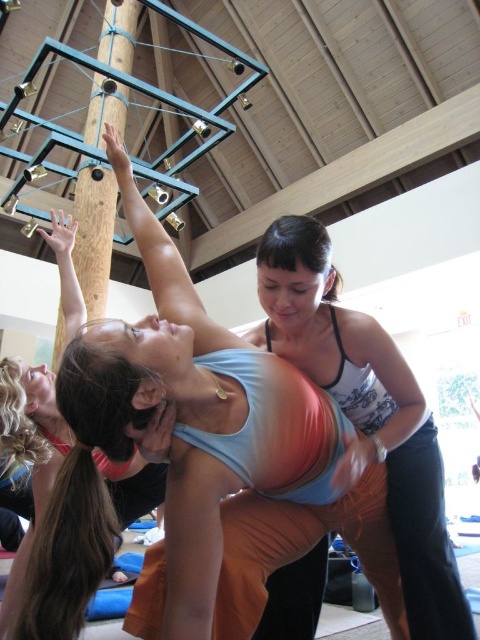
You are a photographer setting up for a yoga class photo. You need to ensure that the matte blue tank top at center and the matte black tank top at center are visible in the frame. Based on their heights, which one might you need to position closer to the camera to ensure both are fully visible?

The matte blue tank top at center is taller than the matte black tank top at center. To ensure both are fully visible, position the shorter matte black tank top at center closer to the camera so it appears larger in the frame, while the taller matte blue tank top at center can be slightly further back.

You are a photographer setting up for a photoshoot in this yoga studio. You need to ensure that both the matte blue tank top at center and the matte pink tank top at upper left are visible in the frame. Given their positions, which tank top will appear smaller in the photo?

The matte blue tank top at center appears smaller because it has a lesser height compared to the matte pink tank top at upper left.

You are a yoga instructor observing the class. You need to adjust the spacing between the two participants wearing the matte black tank top at center and the matte pink tank top at upper left. Which participant should you move to the left to create more space between them?

The matte black tank top at center has a smaller width than the matte pink tank top at upper left. To create more space between them, move the matte pink tank top at upper left to the left since it is wider and requires more space.